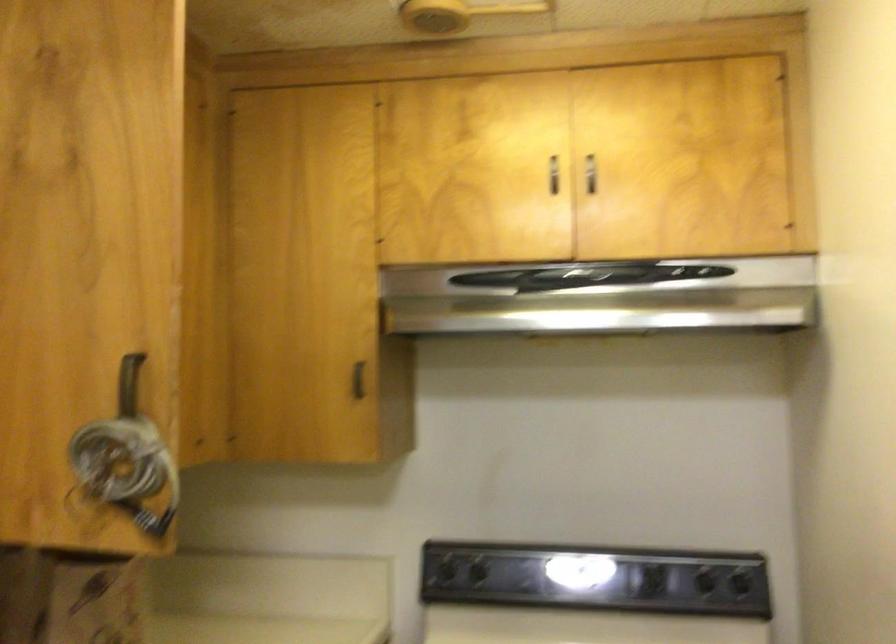
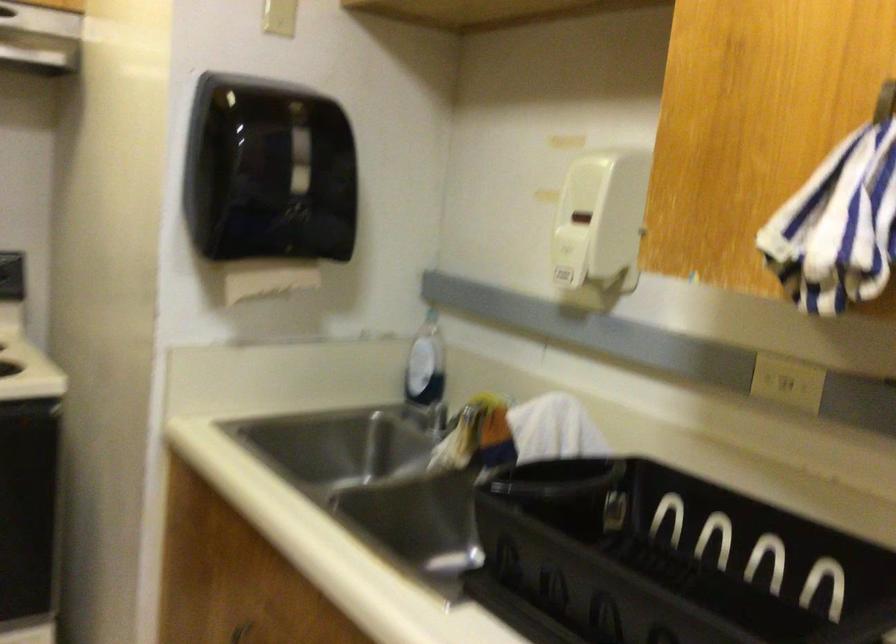
Question: The first image is from the beginning of the video and the second image is from the end. How did the camera likely rotate when shooting the video?

Choices:
 (A) Left
 (B) Right
 (C) Up
 (D) Down

Answer: (B)